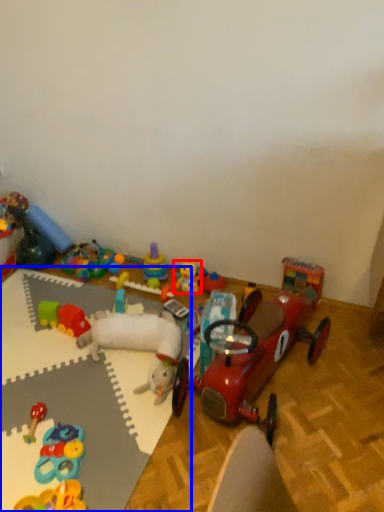
Question: Which of the following is the closest to the observer, toy (highlighted by a red box) or table (highlighted by a blue box)?

Choices:
 (A) toy
 (B) table

Answer: (B)